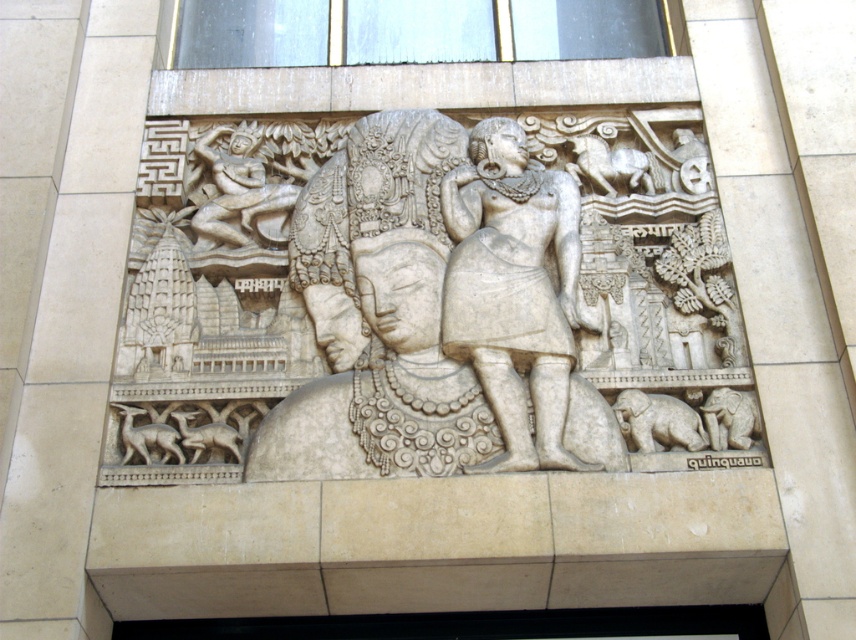
Is white stone carving at center thinner than white stone figure at center?

In fact, white stone carving at center might be wider than white stone figure at center.

Which of these two, white stone carving at center or white stone figure at center, stands shorter?

white stone figure at center is shorter.

Does point (123, 353) lie behind point (503, 452)?

Yes, point (123, 353) is behind point (503, 452).

Identify the location of white stone carving at center. (432, 307).